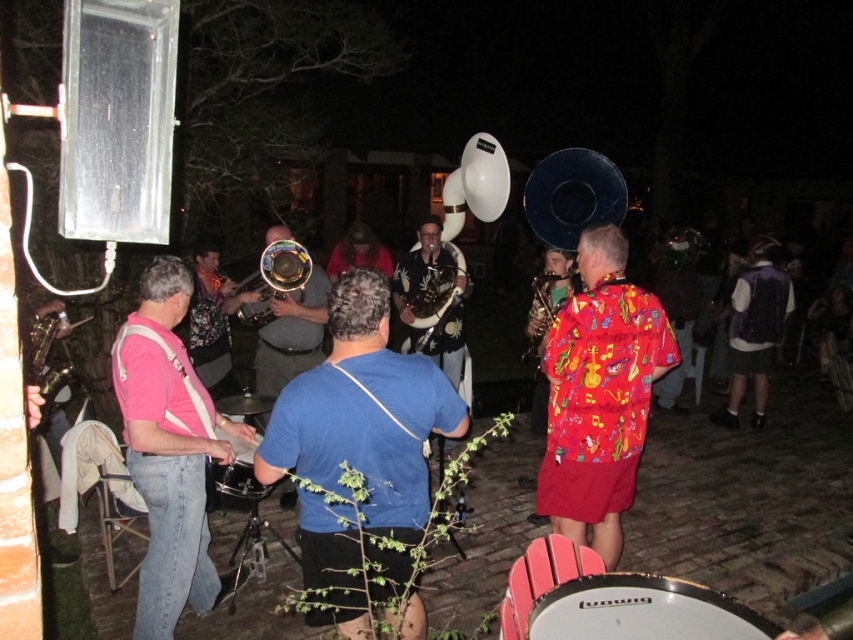
Does black drum at center have a greater width compared to shiny gold saxophone at center?

Incorrect, black drum at center's width does not surpass shiny gold saxophone at center's.

Describe the element at coordinates (236, 483) in the screenshot. I see `black drum at center` at that location.

At what (x,y) coordinates should I click in order to perform the action: click on black drum at center. Please return your answer as a coordinate pair (x, y). Looking at the image, I should click on (236, 483).

Is gold brass trumpet at center above shiny gold saxophone at center?

Yes.

Which is below, gold brass trumpet at center or shiny gold saxophone at center?

shiny gold saxophone at center is below.

Who is more distant from viewer, (277,276) or (540,285)?

Positioned behind is point (277,276).

I want to click on gold brass trumpet at center, so click(273, 278).

How far apart are red cotton shirt at center and pink fabric shirt at left?

A distance of 1.64 meters exists between red cotton shirt at center and pink fabric shirt at left.

Between red cotton shirt at center and pink fabric shirt at left, which one is positioned higher?

red cotton shirt at center is above.

Is point (581, 317) positioned before point (172, 289)?

That is False.

You are a GUI agent. You are given a task and a screenshot of the screen. Output one action in this format:
    pyautogui.click(x=<x>, y=<y>)
    Task: Click on the red cotton shirt at center
    
    Given the screenshot: What is the action you would take?
    pyautogui.click(x=599, y=394)